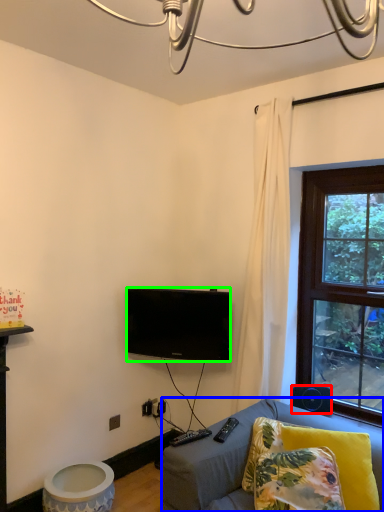
Question: Based on their relative distances, which object is nearer to loudspeaker (highlighted by a red box)? Choose from studio couch (highlighted by a blue box) and television (highlighted by a green box).

Choices:
 (A) studio couch
 (B) television

Answer: (A)